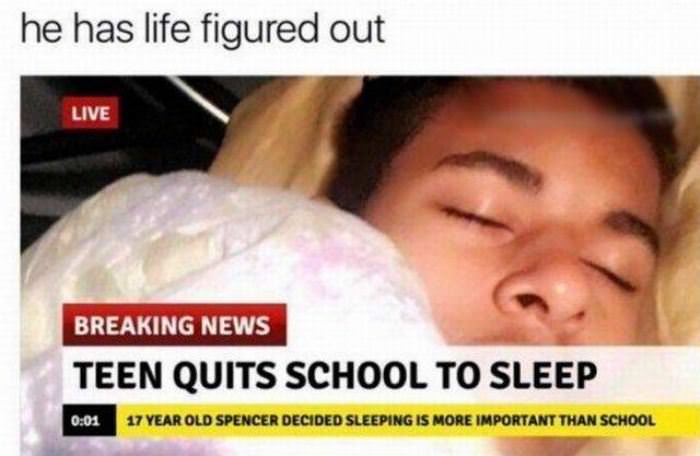
You are a GUI agent. You are given a task and a screenshot of the screen. Output one action in this format:
    pyautogui.click(x=<x>, y=<y>)
    Task: Click on the pillow
    This screenshot has width=700, height=456.
    Given the screenshot: What is the action you would take?
    pyautogui.click(x=295, y=155), pyautogui.click(x=253, y=152), pyautogui.click(x=280, y=114), pyautogui.click(x=318, y=102), pyautogui.click(x=682, y=314), pyautogui.click(x=684, y=271), pyautogui.click(x=685, y=125)